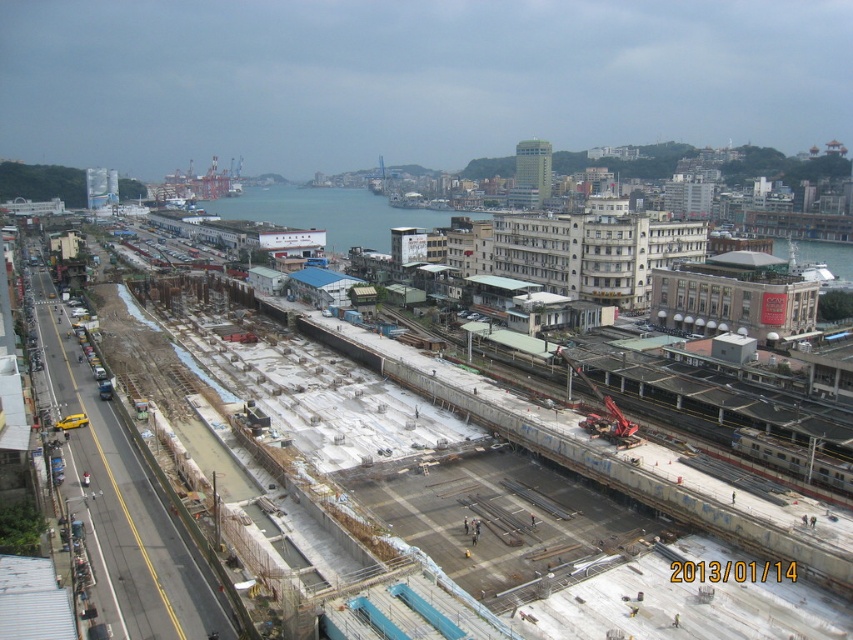
You are a drone operator tasked with capturing aerial footage of the construction site. The drone must hover exactly at the center of the concrete at center. What are the coordinates where the drone should position itself?

The drone should position itself at coordinates point (438, 419) to be exactly at the center of the concrete at center.

You are a delivery drone flying over the urban landscape. You need to deliver a package to a location behind the blue water at center. Can you fly over the concrete at center to reach it?

The concrete at center is in front of blue water at center, so you cannot fly over the concrete at center to reach the location behind the blue water at center because the concrete is blocking the path.